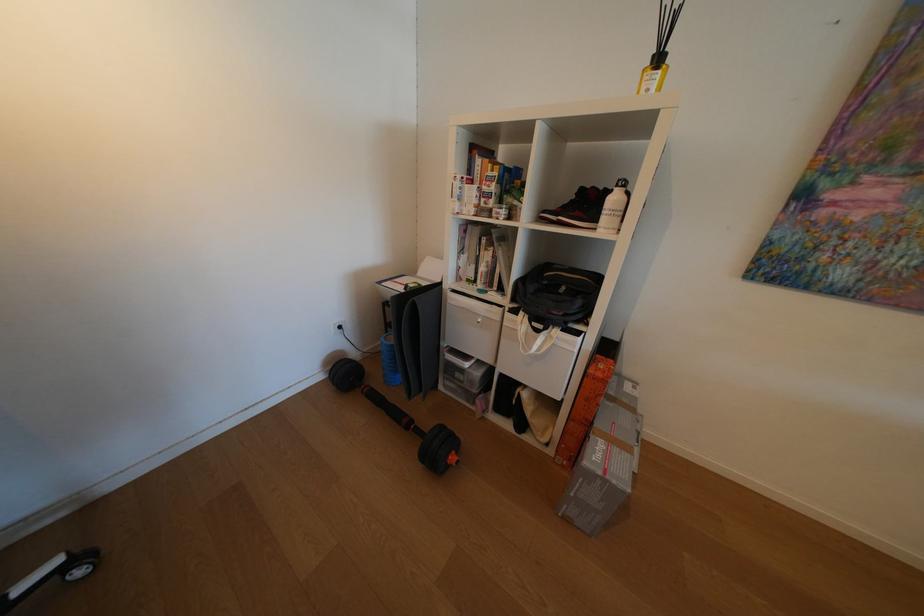
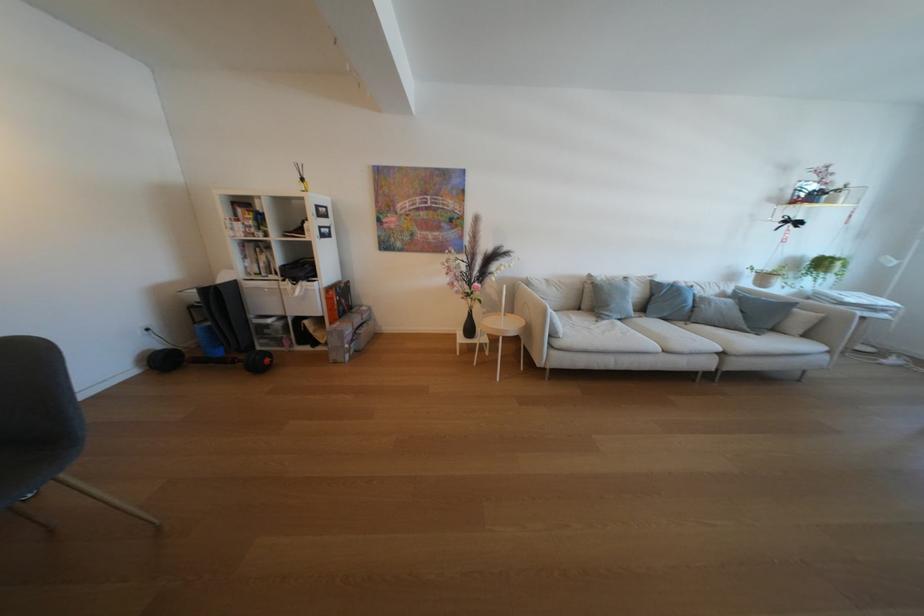
The point at (488,207) is marked in the first image. Where is the corresponding point in the second image?

(256, 233)